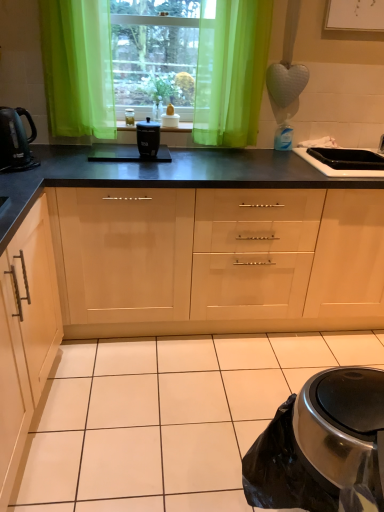
This screenshot has width=384, height=512. What do you see at coordinates (25, 334) in the screenshot?
I see `light wood/finish cabinet at left, which appears as the 1th cabinetry when viewed from the left` at bounding box center [25, 334].

Locate an element on the screen. This screenshot has width=384, height=512. green sheer curtain at center is located at coordinates (231, 72).

What is the approximate width of black plastic container at center?

9.77 inches.

Describe the element at coordinates (343, 161) in the screenshot. The image size is (384, 512). I see `black glossy sink at right` at that location.

You are a GUI agent. You are given a task and a screenshot of the screen. Output one action in this format:
    pyautogui.click(x=<x>, y=<y>)
    Task: Click on the black glossy sink at right
    The height and width of the screenshot is (512, 384).
    Given the screenshot: What is the action you would take?
    pyautogui.click(x=343, y=161)

You are a GUI agent. You are given a task and a screenshot of the screen. Output one action in this format:
    pyautogui.click(x=<x>, y=<y>)
    Task: Click on the matte wood cabinets at center, which ranks as the 2th cabinetry in left-to-right order
    This screenshot has height=512, width=384.
    Given the screenshot: What is the action you would take?
    pyautogui.click(x=217, y=260)

Considering the relative sizes of black matte slow cooker at center and matte wood cabinets at center, the 1th cabinetry positioned from the right, in the image provided, is black matte slow cooker at center shorter than matte wood cabinets at center, the 1th cabinetry positioned from the right,?

Indeed, black matte slow cooker at center has a lesser height compared to matte wood cabinets at center, the 1th cabinetry positioned from the right.

Considering the sizes of objects black matte slow cooker at center and matte wood cabinets at center, the 1th cabinetry positioned from the right, in the image provided, who is bigger, black matte slow cooker at center or matte wood cabinets at center, the 1th cabinetry positioned from the right,?

matte wood cabinets at center, the 1th cabinetry positioned from the right.

Does black matte slow cooker at center come in front of matte wood cabinets at center, which ranks as the 2th cabinetry in left-to-right order?

No, it is not.

From the image's perspective, is black matte slow cooker at center located above matte wood cabinets at center, which ranks as the 2th cabinetry in left-to-right order?

Yes, from the image's perspective, black matte slow cooker at center is over matte wood cabinets at center, which ranks as the 2th cabinetry in left-to-right order.

Is shiny black kettle at left closer to the viewer compared to translucent green curtain at center?

Yes, shiny black kettle at left is in front of translucent green curtain at center.

Considering the points (22, 157) and (189, 34), which point is in front, point (22, 157) or point (189, 34)?

The point (22, 157) is in front.

Which object is wider, shiny black kettle at left or translucent green curtain at center?

Wider between the two is translucent green curtain at center.

Is point (19, 117) farther from camera compared to point (123, 125)?

No, (19, 117) is closer to viewer.

Who is taller, shiny black kettle at left or black plastic container at center?

shiny black kettle at left.

Considering the sizes of objects shiny black kettle at left and black plastic container at center in the image provided, who is thinner, shiny black kettle at left or black plastic container at center?

shiny black kettle at left is thinner.

Would you say shiny black kettle at left contains black plastic container at center?

No, black plastic container at center is not surrounded by shiny black kettle at left.

Is black matte slow cooker at center oriented towards shiny black kettle at left?

No, black matte slow cooker at center is not oriented towards shiny black kettle at left.

Between black matte slow cooker at center and shiny black kettle at left, which one has larger width?

shiny black kettle at left is wider.

From a real-world perspective, is black matte slow cooker at center positioned over shiny black kettle at left based on gravity?

No, from a real-world perspective, black matte slow cooker at center is not on top of shiny black kettle at left.

From the image's perspective, which is below, green sheer curtain at center or light wood/finish cabinet at left, which appears as the 1th cabinetry when viewed from the left?

light wood/finish cabinet at left, which appears as the 1th cabinetry when viewed from the left, from the image's perspective.

Is green sheer curtain at center not within light wood/finish cabinet at left, which appears as the 1th cabinetry when viewed from the left?

Yes, green sheer curtain at center is not within light wood/finish cabinet at left, which appears as the 1th cabinetry when viewed from the left.

Between green sheer curtain at center and light wood/finish cabinet at left, the 2th cabinetry in the right-to-left sequence, which one has smaller width?

With smaller width is green sheer curtain at center.

Where is `sink behind the light wood/finish cabinet at left, the 2th cabinetry in the right-to-left sequence`? This screenshot has height=512, width=384. sink behind the light wood/finish cabinet at left, the 2th cabinetry in the right-to-left sequence is located at coordinates (343, 161).

Is light wood/finish cabinet at left, the 2th cabinetry in the right-to-left sequence, to the left of black glossy sink at right from the viewer's perspective?

Yes, light wood/finish cabinet at left, the 2th cabinetry in the right-to-left sequence, is to the left of black glossy sink at right.

Between light wood/finish cabinet at left, the 2th cabinetry in the right-to-left sequence, and black glossy sink at right, which one is positioned in front?

light wood/finish cabinet at left, the 2th cabinetry in the right-to-left sequence, is in front.

From the image's perspective, which object appears higher, black plastic container at center or black glossy sink at right?

black plastic container at center, from the image's perspective.

From a real-world perspective, is black plastic container at center physically above black glossy sink at right?

Yes.

Consider the image. Which of these two, black plastic container at center or black glossy sink at right, is smaller?

With smaller size is black plastic container at center.

How many degrees apart are the facing directions of black plastic container at center and black glossy sink at right?

They differ by 0.311 degrees in their facing directions.

Find the location of a particular element. This screenshot has height=512, width=384. kitchen appliance above the matte wood cabinets at center, which ranks as the 2th cabinetry in left-to-right order (from a real-world perspective) is located at coordinates point(148,138).

Identify the location of home appliance below the translucent green curtain at center (from a real-world perspective). This screenshot has height=512, width=384. (15, 140).

Based on their spatial positions, is matte wood cabinets at center, the 1th cabinetry positioned from the right, or black matte slow cooker at center closer to translucent green curtain at center?

The object closer to translucent green curtain at center is black matte slow cooker at center.

Based on their spatial positions, is black matte slow cooker at center or black plastic container at center closer to matte wood cabinets at center, the 1th cabinetry positioned from the right?

Based on the image, black matte slow cooker at center appears to be nearer to matte wood cabinets at center, the 1th cabinetry positioned from the right.

Estimate the real-world distances between objects in this image. Which object is further from light wood/finish cabinet at left, which appears as the 1th cabinetry when viewed from the left, black glossy sink at right or black plastic container at center?

black glossy sink at right is further to light wood/finish cabinet at left, which appears as the 1th cabinetry when viewed from the left.

Based on their spatial positions, is translucent green curtain at center or shiny black kettle at left closer to green sheer curtain at center?

Based on the image, translucent green curtain at center appears to be nearer to green sheer curtain at center.

From the image, which object appears to be nearer to shiny black kettle at left, black matte slow cooker at center or black plastic container at center?

black matte slow cooker at center lies closer to shiny black kettle at left than the other object.

Estimate the real-world distances between objects in this image. Which object is further from matte wood cabinets at center, which ranks as the 2th cabinetry in left-to-right order, black plastic container at center or black glossy sink at right?

black plastic container at center is positioned further to the anchor matte wood cabinets at center, which ranks as the 2th cabinetry in left-to-right order.

Looking at the image, which one is located further to green sheer curtain at center, black plastic container at center or matte wood cabinets at center, the 1th cabinetry positioned from the right?

matte wood cabinets at center, the 1th cabinetry positioned from the right.

When comparing their distances from green sheer curtain at center, does light wood/finish cabinet at left, the 2th cabinetry in the right-to-left sequence, or matte wood cabinets at center, which ranks as the 2th cabinetry in left-to-right order, seem closer?

Answer: matte wood cabinets at center, which ranks as the 2th cabinetry in left-to-right order, lies closer to green sheer curtain at center than the other object.

This screenshot has height=512, width=384. I want to click on home appliance between translucent green curtain at center and light wood/finish cabinet at left, which appears as the 1th cabinetry when viewed from the left, in the vertical direction, so click(x=15, y=140).

You are a GUI agent. You are given a task and a screenshot of the screen. Output one action in this format:
    pyautogui.click(x=<x>, y=<y>)
    Task: Click on the home appliance between light wood/finish cabinet at left, the 2th cabinetry in the right-to-left sequence, and green sheer curtain at center from front to back
    
    Given the screenshot: What is the action you would take?
    pyautogui.click(x=15, y=140)

Where is `curtain between shiny black kettle at left and matte wood cabinets at center, which ranks as the 2th cabinetry in left-to-right order, in the horizontal direction`? The width and height of the screenshot is (384, 512). curtain between shiny black kettle at left and matte wood cabinets at center, which ranks as the 2th cabinetry in left-to-right order, in the horizontal direction is located at coordinates (231, 72).

Where is `kitchen appliance situated between shiny black kettle at left and matte wood cabinets at center, which ranks as the 2th cabinetry in left-to-right order, from left to right`? The height and width of the screenshot is (512, 384). kitchen appliance situated between shiny black kettle at left and matte wood cabinets at center, which ranks as the 2th cabinetry in left-to-right order, from left to right is located at coordinates (148, 138).